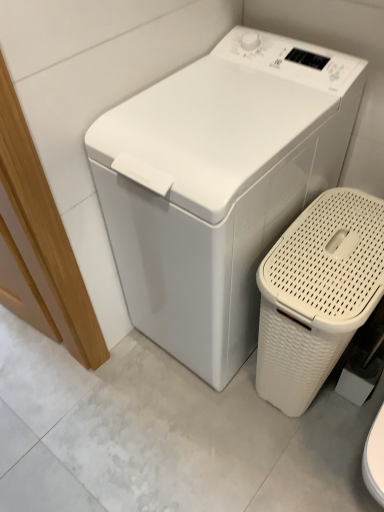
Where is `free point in front of white woven basket at lower right`? The height and width of the screenshot is (512, 384). free point in front of white woven basket at lower right is located at coordinates pos(294,455).